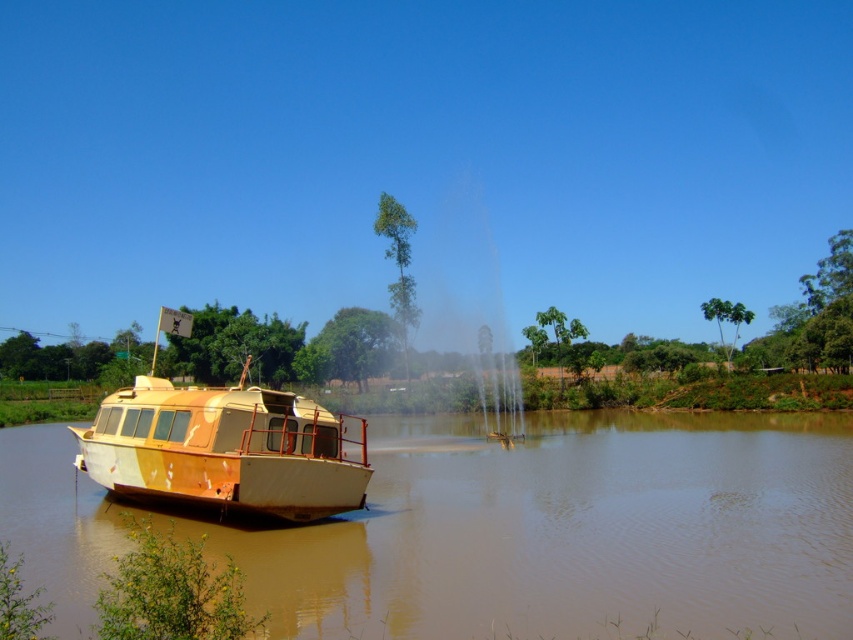
Does point (659, 614) come farther from viewer compared to point (143, 419)?

That is False.

Can you confirm if brown matte boat at left is thinner than rusty metal boat at left?

No.

Identify the location of brown matte boat at left. (572, 531).